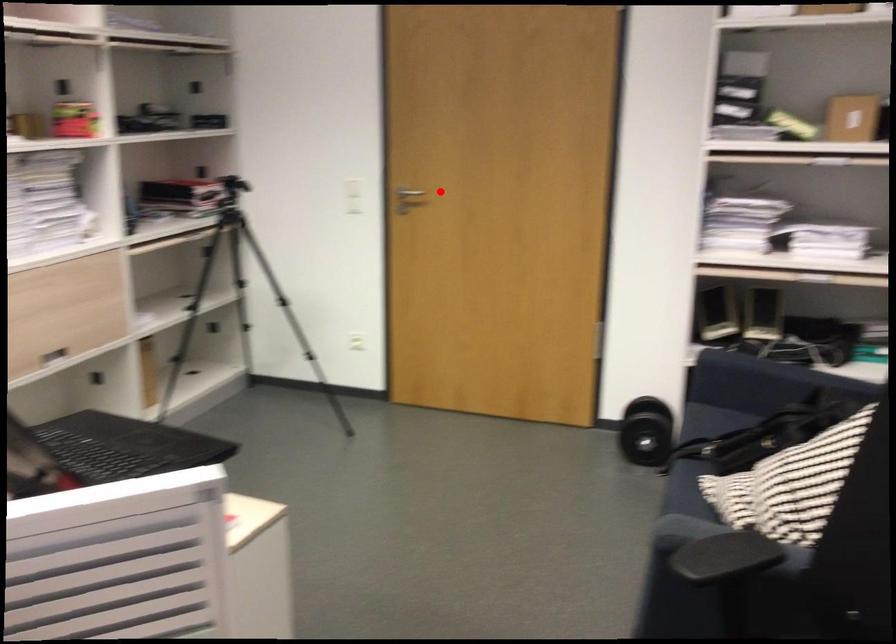
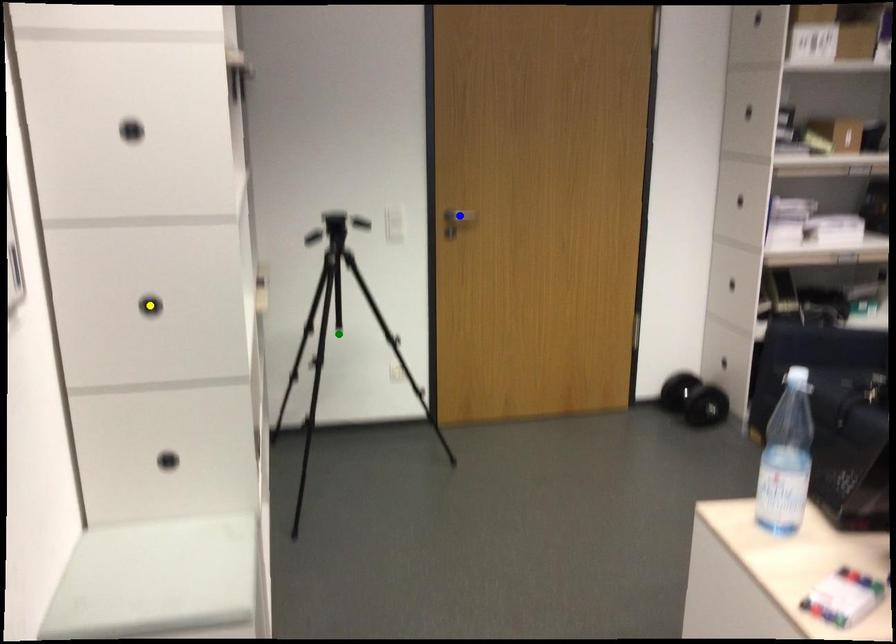
Question: I am providing you with two images of the same scene from different viewpoints. A red point is marked on the first image. You are given multiple points on the second image. In image 2, which mark is for the same physical point as the one in image 1?

Choices:
 (A) blue point
 (B) green point
 (C) yellow point

Answer: (A)